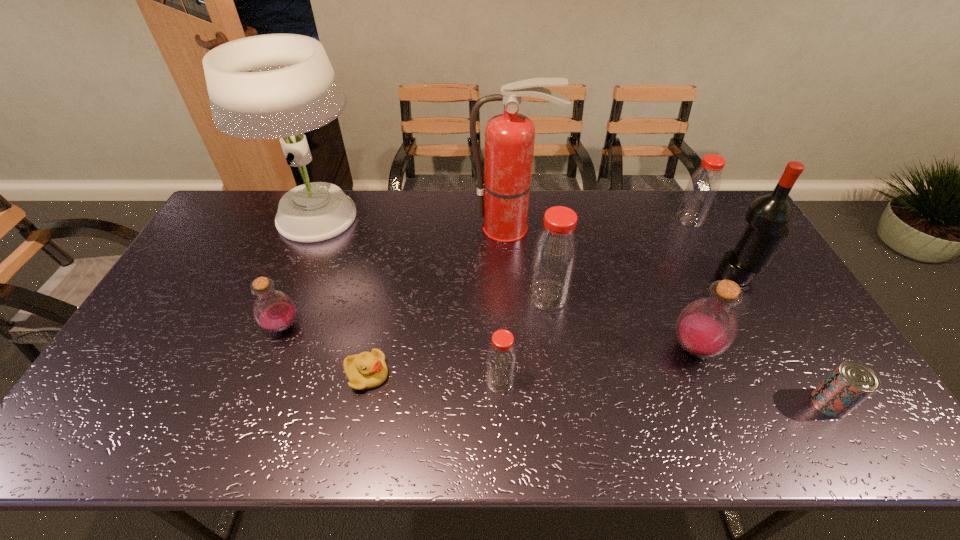
The height and width of the screenshot is (540, 960). In order to click on white lamp in this screenshot , I will do `click(270, 86)`.

Find the location of a particular element. The height and width of the screenshot is (540, 960). red fire extinguisher is located at coordinates (503, 196).

At what (x,y) coordinates should I click in order to perform the action: click on the third tallest object. Please return your answer as a coordinate pair (x, y). This screenshot has height=540, width=960. Looking at the image, I should click on (767, 216).

At what (x,y) coordinates should I click in order to perform the action: click on wine bottle. Please return your answer as a coordinate pair (x, y). Looking at the image, I should click on (767, 216).

The image size is (960, 540). Find the location of `the second farthest red bottle`. the second farthest red bottle is located at coordinates (554, 257).

The height and width of the screenshot is (540, 960). In order to click on the third bottle from right to left in this screenshot , I will do `click(554, 257)`.

Locate an element on the screen. the rightmost bottle is located at coordinates (703, 186).

Locate an element on the screen. the second smallest red bottle is located at coordinates [703, 186].

You are a GUI agent. You are given a task and a screenshot of the screen. Output one action in this format:
    pyautogui.click(x=<x>, y=<y>)
    Task: Click on the bigger purple bottle
    This screenshot has width=960, height=540.
    Given the screenshot: What is the action you would take?
    point(707,327)

This screenshot has height=540, width=960. I want to click on the right purple bottle, so coord(707,327).